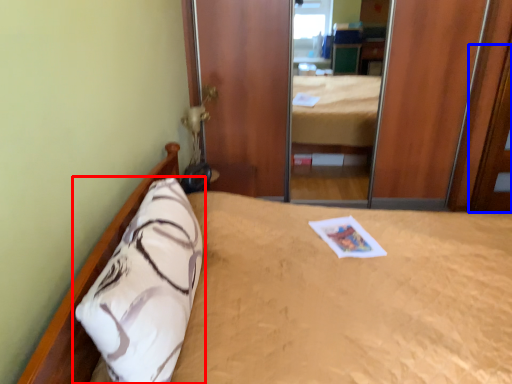
Question: Which point is closer to the camera, pillow (highlighted by a red box) or door (highlighted by a blue box)?

Choices:
 (A) pillow
 (B) door

Answer: (A)